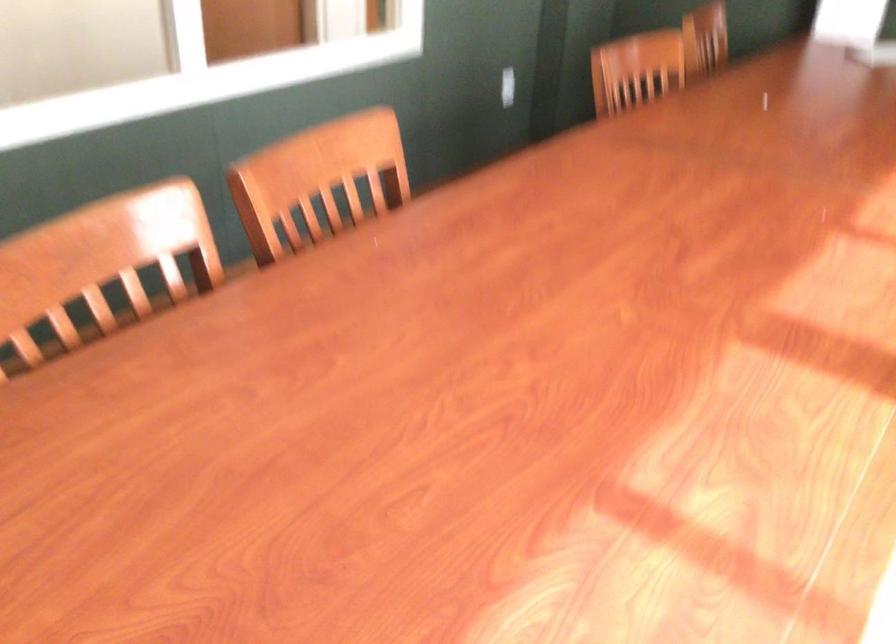
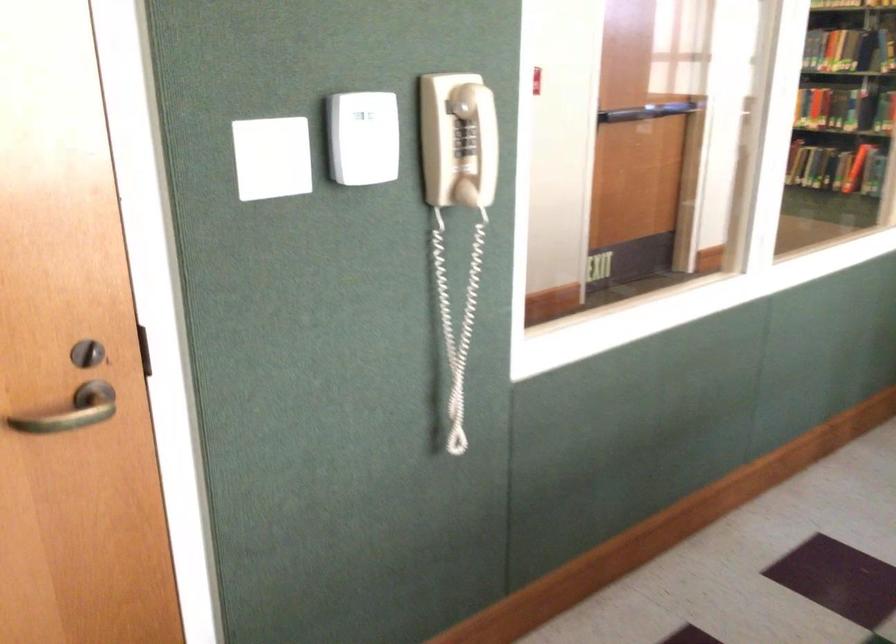
Question: What movement of the cameraman would produce the second image?

Choices:
 (A) Left
 (B) Right
 (C) Forward
 (D) Backward

Answer: (A)